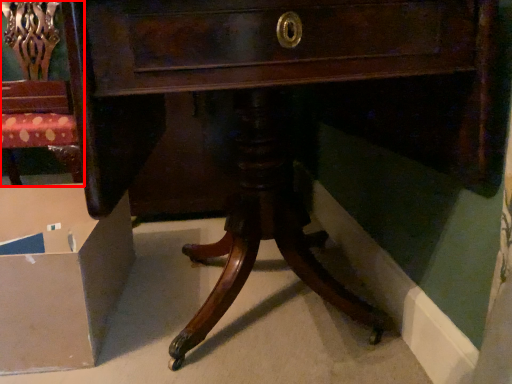
Question: Considering the relative positions of chair (annotated by the red box) and cardboard box in the image provided, where is chair (annotated by the red box) located with respect to the staircase?

Choices:
 (A) left
 (B) right

Answer: (A)